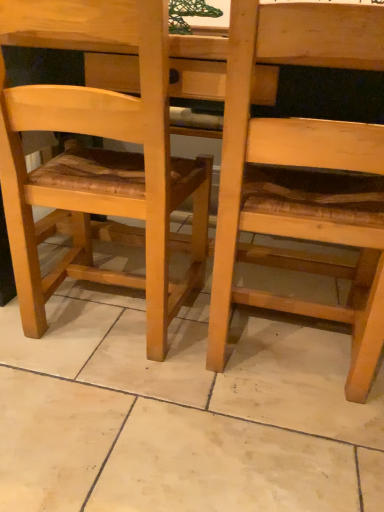
Where is `free location to the right of natural wood chair at center`? This screenshot has width=384, height=512. free location to the right of natural wood chair at center is located at coordinates (245, 352).